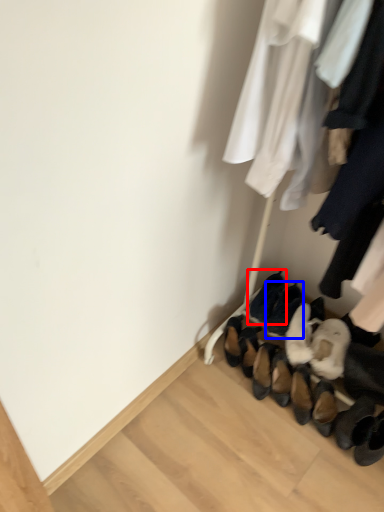
Question: Which object appears closest to the camera in this image, footwear (highlighted by a red box) or footwear (highlighted by a blue box)?

Choices:
 (A) footwear
 (B) footwear

Answer: (B)